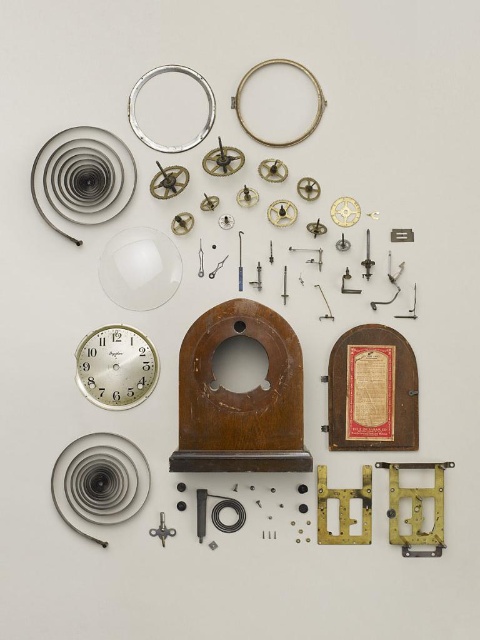
Can you confirm if transparent plastic plate at center is positioned to the right of silver/metallic ring at upper center?

In fact, transparent plastic plate at center is to the left of silver/metallic ring at upper center.

Who is taller, transparent plastic plate at center or silver/metallic ring at upper center?

silver/metallic ring at upper center is taller.

Who is more forward, (165, 294) or (308, 74)?

Point (165, 294) is in front.

Where is `transparent plastic plate at center`? The height and width of the screenshot is (640, 480). transparent plastic plate at center is located at coordinates (140, 268).

Between silver metallic clock face at center-left and transparent plastic plate at center, which one appears on the right side from the viewer's perspective?

From the viewer's perspective, transparent plastic plate at center appears more on the right side.

Who is more distant from viewer, (x=122, y=344) or (x=154, y=232)?

The point (x=154, y=232) is more distant.

The image size is (480, 640). Find the location of `silver metallic clock face at center-left`. silver metallic clock face at center-left is located at coordinates (116, 365).

Between silver metallic clock face at center-left and silver/metallic ring at upper left, which one is positioned lower?

silver metallic clock face at center-left is below.

Between silver metallic clock face at center-left and silver/metallic ring at upper left, which one appears on the left side from the viewer's perspective?

From the viewer's perspective, silver metallic clock face at center-left appears more on the left side.

Is point (119, 404) behind point (184, 147)?

No.

You are a GUI agent. You are given a task and a screenshot of the screen. Output one action in this format:
    pyautogui.click(x=<x>, y=<y>)
    Task: Click on the silver metallic clock face at center-left
    The image size is (480, 640).
    Given the screenshot: What is the action you would take?
    pyautogui.click(x=116, y=365)